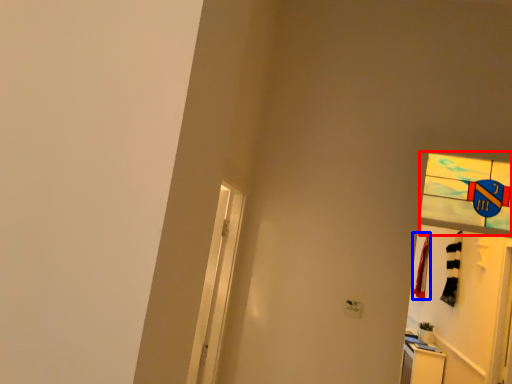
Question: Which of the following is the farthest to the observer, glass window (highlighted by a red box) or laundry (highlighted by a blue box)?

Choices:
 (A) glass window
 (B) laundry

Answer: (B)